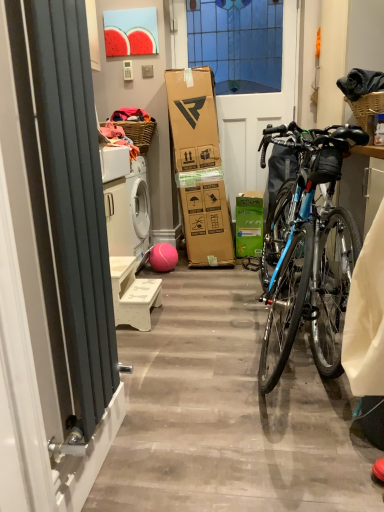
This screenshot has height=512, width=384. I want to click on white plastic power outlet at upper center, so click(x=127, y=70).

Locate an element on the screen. The width and height of the screenshot is (384, 512). white glossy door at center is located at coordinates (257, 116).

You are a GUI agent. You are given a task and a screenshot of the screen. Output one action in this format:
    pyautogui.click(x=<x>, y=<y>)
    Task: Click on the white matte bench at lower center
    This screenshot has height=512, width=384.
    Given the screenshot: What is the action you would take?
    pyautogui.click(x=133, y=293)

Image resolution: width=384 pixels, height=512 pixels. What do you see at coordinates (139, 132) in the screenshot?
I see `woven brown picnic basket at upper center, the second picnic basket viewed from the front` at bounding box center [139, 132].

What do you see at coordinates (366, 106) in the screenshot? The image size is (384, 512). I see `woven brown picnic basket at right, which is the first picnic basket in front-to-back order` at bounding box center [366, 106].

Where is `white plastic power outlet at upper center`? This screenshot has width=384, height=512. white plastic power outlet at upper center is located at coordinates 127,70.

Does point (152, 250) appear closer or farther from the camera than point (245, 229)?

Point (152, 250) is positioned farther from the camera compared to point (245, 229).

Are rubber ball at center and green matte box at center beside each other?

No, rubber ball at center is not with green matte box at center.

Is rubber ball at center inside or outside of green matte box at center?

rubber ball at center is not enclosed by green matte box at center.

Is dark blue fabric at upper right in contact with matte black radiator at left?

No, dark blue fabric at upper right is not next to matte black radiator at left.

From the image's perspective, is dark blue fabric at upper right below matte black radiator at left?

Answer: No, from the image's perspective, dark blue fabric at upper right is not below matte black radiator at left.

Considering the relative positions of dark blue fabric at upper right and matte black radiator at left in the image provided, is dark blue fabric at upper right behind matte black radiator at left?

That is True.

Which is more to the left, dark blue fabric at upper right or matte black radiator at left?

matte black radiator at left is more to the left.

From the image's perspective, is woven brown picnic basket at right, acting as the 1th picnic basket starting from the right, above or below green matte box at center?

woven brown picnic basket at right, acting as the 1th picnic basket starting from the right, is above green matte box at center.

Which is in front, point (367, 104) or point (257, 207)?

The point (367, 104) is more forward.

From a real-world perspective, is woven brown picnic basket at right, the second picnic basket positioned from the left, positioned over green matte box at center based on gravity?

Correct, in the physical world, woven brown picnic basket at right, the second picnic basket positioned from the left, is higher than green matte box at center.

From a real-world perspective, between matte black radiator at left and white matte bench at lower center, who is vertically lower?

white matte bench at lower center.

Which of these two, matte black radiator at left or white matte bench at lower center, is bigger?

With larger size is matte black radiator at left.

Is matte black radiator at left looking in the opposite direction of white matte bench at lower center?

No, white matte bench at lower center is not at the back of matte black radiator at left.

From the picture: Which is behind, matte black radiator at left or white matte bench at lower center?

white matte bench at lower center is more distant.

Is green matte box at center positioned with its back to matte black radiator at left?

green matte box at center is not turned away from matte black radiator at left.

Considering the sizes of objects green matte box at center and matte black radiator at left in the image provided, who is bigger, green matte box at center or matte black radiator at left?

With larger size is green matte box at center.

From the image's perspective, which one is positioned higher, green matte box at center or matte black radiator at left?

green matte box at center, from the image's perspective.

From a real-world perspective, is green matte box at center above or below woven brown picnic basket at upper center, the second picnic basket viewed from the front?

green matte box at center is below woven brown picnic basket at upper center, the second picnic basket viewed from the front.

Based on the photo, what's the angular difference between green matte box at center and woven brown picnic basket at upper center, which is counted as the 1th picnic basket, starting from the left,'s facing directions?

The angular difference between green matte box at center and woven brown picnic basket at upper center, which is counted as the 1th picnic basket, starting from the left, is 89.8 degrees.

Is green matte box at center situated inside woven brown picnic basket at upper center, the second picnic basket viewed from the front, or outside?

green matte box at center cannot be found inside woven brown picnic basket at upper center, the second picnic basket viewed from the front.

Which of these two, green matte box at center or woven brown picnic basket at upper center, which is counted as the 1th picnic basket, starting from the left, is wider?

Wider between the two is woven brown picnic basket at upper center, which is counted as the 1th picnic basket, starting from the left.

Is rubber ball at center oriented away from woven brown picnic basket at right, the second picnic basket viewed from the back?

No, woven brown picnic basket at right, the second picnic basket viewed from the back, is not at the back of rubber ball at center.

Which point is more distant from viewer, (168, 244) or (349, 100)?

Point (168, 244)

Is rubber ball at center wider or thinner than woven brown picnic basket at right, acting as the 1th picnic basket starting from the right?

rubber ball at center is thinner than woven brown picnic basket at right, acting as the 1th picnic basket starting from the right.

Considering the sizes of objects rubber ball at center and woven brown picnic basket at right, the second picnic basket positioned from the left, in the image provided, who is shorter, rubber ball at center or woven brown picnic basket at right, the second picnic basket positioned from the left,?

Standing shorter between the two is rubber ball at center.

Identify the location of ball beneath the green matte box at center (from a real-world perspective). This screenshot has height=512, width=384. (163, 257).

Locate an element on the screen. This screenshot has height=512, width=384. material above the matte black radiator at left (from a real-world perspective) is located at coordinates (360, 83).

In the scene shown: Considering their positions, is woven brown picnic basket at right, acting as the 1th picnic basket starting from the right, positioned further to white glossy door at center than rubber ball at center?

woven brown picnic basket at right, acting as the 1th picnic basket starting from the right, is further to white glossy door at center.

From the image, which object appears to be farther from white matte bench at lower center, matte black radiator at left or dark blue fabric at upper right?

Based on the image, dark blue fabric at upper right appears to be further to white matte bench at lower center.

From the picture: When comparing their distances from white matte bench at lower center, does white plastic power outlet at upper center or rubber ball at center seem further?

The object further to white matte bench at lower center is white plastic power outlet at upper center.

Based on their spatial positions, is white glossy door at center or dark blue fabric at upper right further from green matte box at center?

dark blue fabric at upper right is positioned further to the anchor green matte box at center.

Considering their positions, is matte black radiator at left positioned further to woven brown picnic basket at upper center, which ranks as the second picnic basket in right-to-left order, than dark blue fabric at upper right?

Among the two, matte black radiator at left is located further to woven brown picnic basket at upper center, which ranks as the second picnic basket in right-to-left order.

Based on their spatial positions, is dark blue fabric at upper right or woven brown picnic basket at upper center, which is counted as the 1th picnic basket, starting from the left, closer to green matte box at center?

The object closer to green matte box at center is woven brown picnic basket at upper center, which is counted as the 1th picnic basket, starting from the left.

Looking at this image, considering their positions, is matte black radiator at left positioned closer to white glossy door at center than woven brown picnic basket at right, the second picnic basket viewed from the back?

Based on the image, woven brown picnic basket at right, the second picnic basket viewed from the back, appears to be nearer to white glossy door at center.

Looking at the image, which one is located further to woven brown picnic basket at upper center, which is counted as the 1th picnic basket, starting from the left, white plastic power outlet at upper center or dark blue fabric at upper right?

dark blue fabric at upper right lies further to woven brown picnic basket at upper center, which is counted as the 1th picnic basket, starting from the left, than the other object.

The image size is (384, 512). Identify the location of power outlet located between woven brown picnic basket at upper center, positioned as the first picnic basket in back-to-front order, and dark blue fabric at upper right in the left-right direction. (127, 70).

This screenshot has height=512, width=384. Find the location of `ball located between white matte bench at lower center and dark blue fabric at upper right in the left-right direction`. ball located between white matte bench at lower center and dark blue fabric at upper right in the left-right direction is located at coordinates (163, 257).

Where is `material between white plastic power outlet at upper center and white matte bench at lower center vertically`? This screenshot has width=384, height=512. material between white plastic power outlet at upper center and white matte bench at lower center vertically is located at coordinates (360, 83).

Locate an element on the screen. This screenshot has width=384, height=512. screen door located between woven brown picnic basket at upper center, the second picnic basket viewed from the front, and dark blue fabric at upper right in the left-right direction is located at coordinates (257, 116).